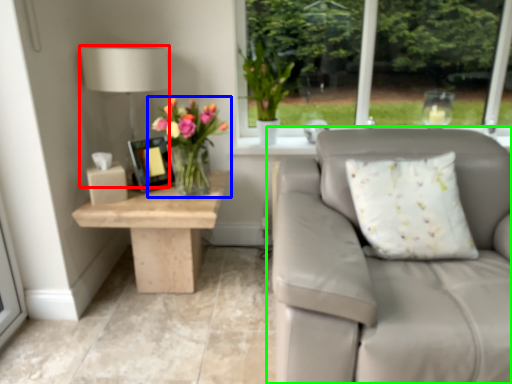
Question: Which object is the closest to the table lamp (highlighted by a red box)? Choose among these: houseplant (highlighted by a blue box) or studio couch (highlighted by a green box).

Choices:
 (A) houseplant
 (B) studio couch

Answer: (A)